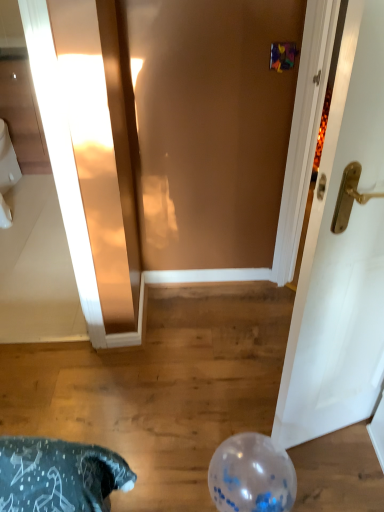
Question: Is white glossy toilet bowl at left beside transparent plastic balloon at lower center?

Choices:
 (A) yes
 (B) no

Answer: (B)

Question: Is white glossy toilet bowl at left wider than transparent plastic balloon at lower center?

Choices:
 (A) no
 (B) yes

Answer: (B)

Question: Could you tell me if white glossy toilet bowl at left is turned towards transparent plastic balloon at lower center?

Choices:
 (A) yes
 (B) no

Answer: (B)

Question: Considering the relative positions of white glossy toilet bowl at left and transparent plastic balloon at lower center in the image provided, is white glossy toilet bowl at left to the left of transparent plastic balloon at lower center from the viewer's perspective?

Choices:
 (A) yes
 (B) no

Answer: (A)

Question: Can you confirm if white glossy toilet bowl at left is shorter than transparent plastic balloon at lower center?

Choices:
 (A) yes
 (B) no

Answer: (B)

Question: Is white glossy toilet bowl at left positioned behind transparent plastic balloon at lower center?

Choices:
 (A) no
 (B) yes

Answer: (B)

Question: Is transparent plastic balloon at lower center bigger than white glossy toilet bowl at left?

Choices:
 (A) no
 (B) yes

Answer: (A)

Question: From a real-world perspective, is transparent plastic balloon at lower center physically below white glossy toilet bowl at left?

Choices:
 (A) yes
 (B) no

Answer: (A)

Question: Does transparent plastic balloon at lower center come behind white glossy toilet bowl at left?

Choices:
 (A) yes
 (B) no

Answer: (B)

Question: Is transparent plastic balloon at lower center facing away from white glossy toilet bowl at left?

Choices:
 (A) no
 (B) yes

Answer: (A)

Question: From a real-world perspective, is transparent plastic balloon at lower center physically above white glossy toilet bowl at left?

Choices:
 (A) yes
 (B) no

Answer: (B)

Question: Does transparent plastic balloon at lower center have a lesser height compared to white glossy toilet bowl at left?

Choices:
 (A) no
 (B) yes

Answer: (B)

Question: Visually, is white glossy toilet bowl at left positioned to the left or to the right of transparent plastic balloon at lower center?

Choices:
 (A) left
 (B) right

Answer: (A)